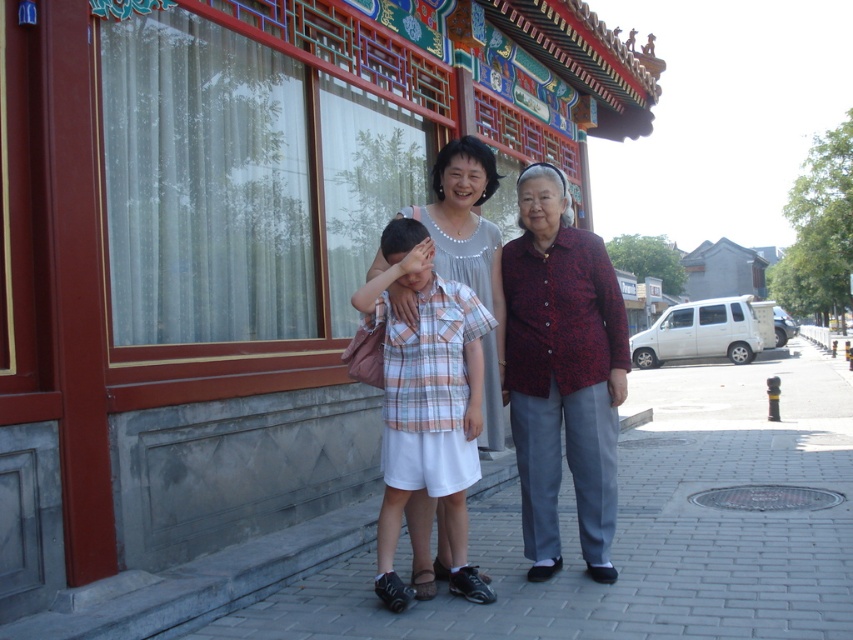
You are a photographer trying to capture the scene. You notice a specific point at coordinates (x=560, y=369). Which object in the scene does this point lie on?

The point at coordinates (x=560, y=369) lies on the matte plaid shirt at center.